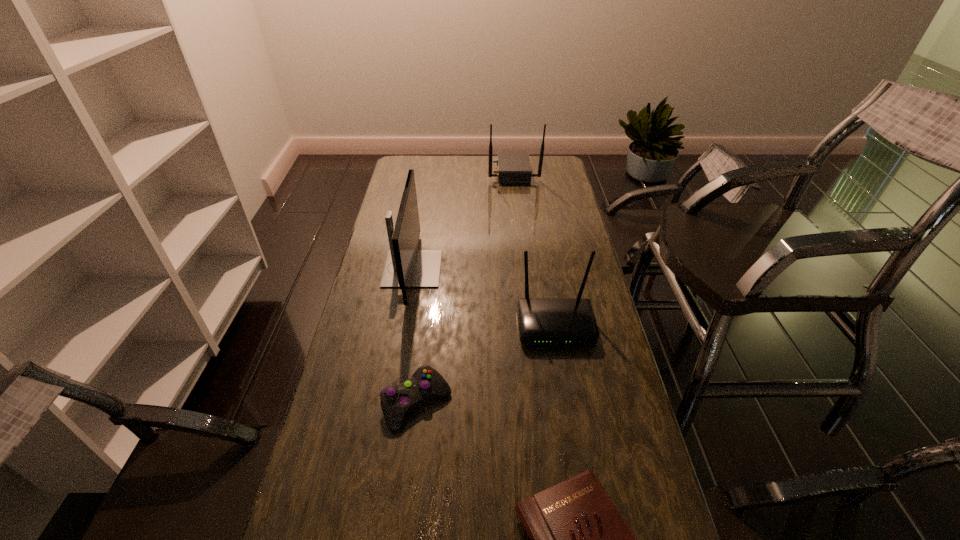
Image resolution: width=960 pixels, height=540 pixels. Find the location of `blank region between the taller router and the computer monitor`. blank region between the taller router and the computer monitor is located at coordinates (463, 220).

Locate an element on the screen. The width and height of the screenshot is (960, 540). vacant area between the computer monitor and the farthest object is located at coordinates (463, 220).

Image resolution: width=960 pixels, height=540 pixels. Find the location of `unoccupied position between the control and the farthest object`. unoccupied position between the control and the farthest object is located at coordinates (465, 287).

Find the location of a particular element. The image size is (960, 540). vacant point located between the computer monitor and the control is located at coordinates (x=415, y=336).

Image resolution: width=960 pixels, height=540 pixels. Find the location of `free space that is in between the nearer router and the farthest object`. free space that is in between the nearer router and the farthest object is located at coordinates (x=535, y=248).

At what (x,y) coordinates should I click in order to perform the action: click on vacant region between the shorter router and the computer monitor. Please return your answer as a coordinate pair (x, y). The width and height of the screenshot is (960, 540). Looking at the image, I should click on (484, 297).

Identify the location of object that is the third nearest to the fourth farthest object. Image resolution: width=960 pixels, height=540 pixels. (405, 267).

Find the location of a particular element. The image size is (960, 540). object that is the third closest to the computer monitor is located at coordinates (513, 167).

The width and height of the screenshot is (960, 540). Find the location of `vacant position in the image that satisfies the following two spatial constraints: 1. on the back of the taller router to connect cables; 2. on the front side of the fourth farthest object`. vacant position in the image that satisfies the following two spatial constraints: 1. on the back of the taller router to connect cables; 2. on the front side of the fourth farthest object is located at coordinates (540, 403).

Image resolution: width=960 pixels, height=540 pixels. In order to click on blank area in the image that satisfies the following two spatial constraints: 1. on the screen of the computer monitor; 2. on the back side of the control in this screenshot , I will do `click(390, 403)`.